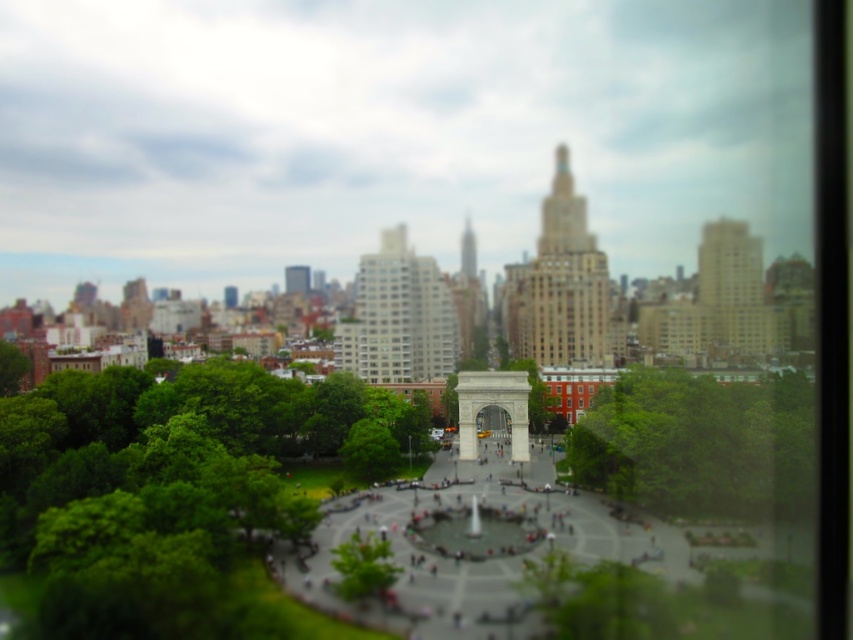
Question: Is green leafy tree at lower left closer to camera compared to green leafy tree at center?

Choices:
 (A) yes
 (B) no

Answer: (A)

Question: From the image, what is the correct spatial relationship of green leafy tree at lower left in relation to green leafy tree at center?

Choices:
 (A) above
 (B) below

Answer: (B)

Question: Which point is farther from the camera taking this photo?

Choices:
 (A) (670, 426)
 (B) (283, 396)

Answer: (B)

Question: Does green leafy tree at lower left have a lesser width compared to green leafy tree at center?

Choices:
 (A) no
 (B) yes

Answer: (A)

Question: Which object appears closest to the camera in this image?

Choices:
 (A) green leafy tree at center
 (B) green leafy tree at lower left

Answer: (B)